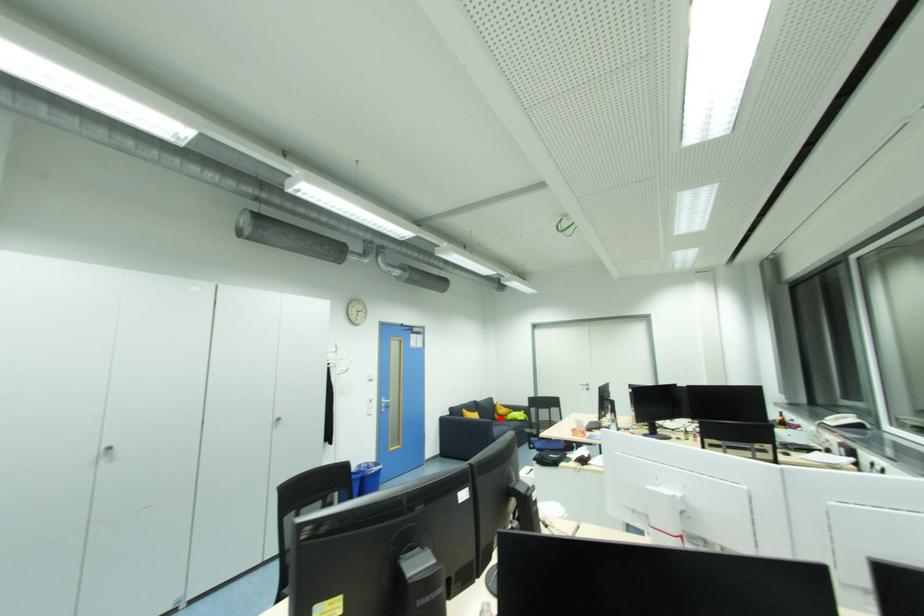
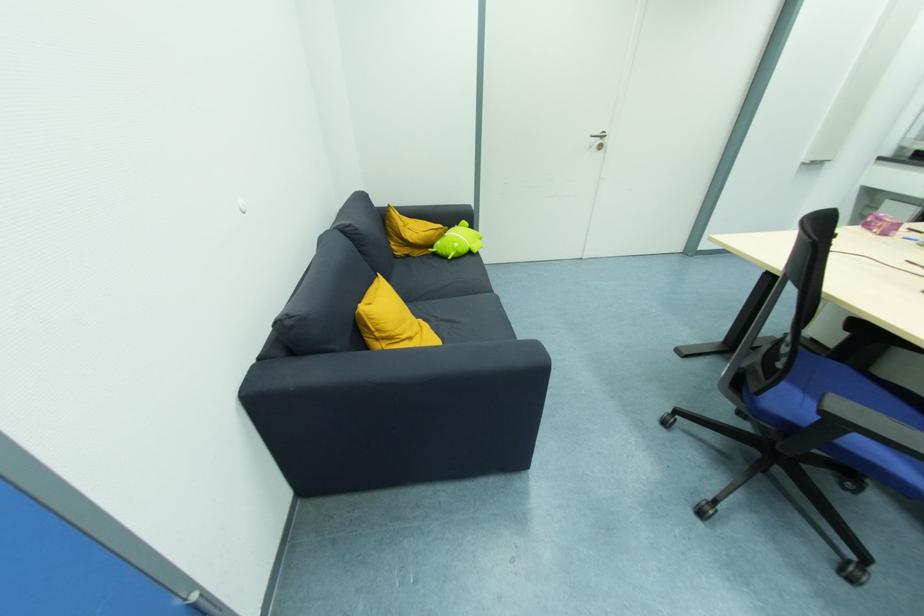
Question: I am providing you with two images of the same scene from different viewpoints. Image1 has a red point marked. In image2, the corresponding 3D location appears at what relative position? Reply with the corresponding letter.

Choices:
 (A) Closer
 (B) Farther

Answer: (A)